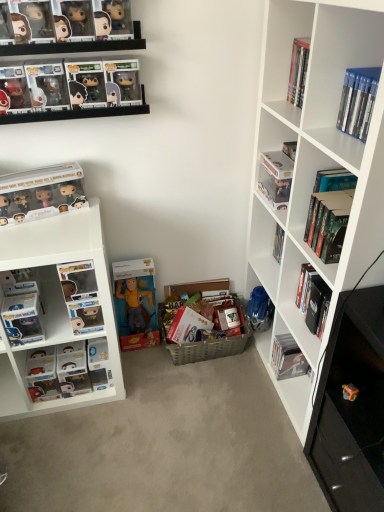
Locate an element on the screen. The width and height of the screenshot is (384, 512). vacant space positioned to the left of hardcover book at lower right, the 5th book when ordered from left to right is located at coordinates (249, 380).